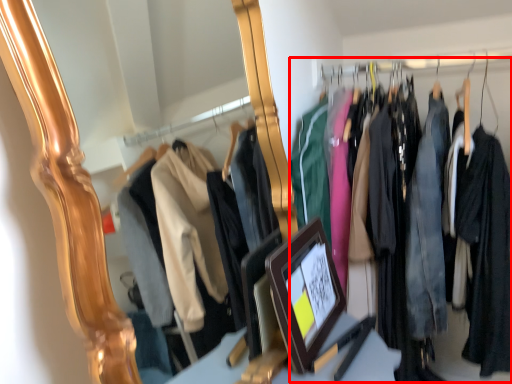
Question: Considering the relative positions of closet (annotated by the red box) and picture frame in the image provided, where is closet (annotated by the red box) located with respect to the staircase?

Choices:
 (A) right
 (B) left

Answer: (A)